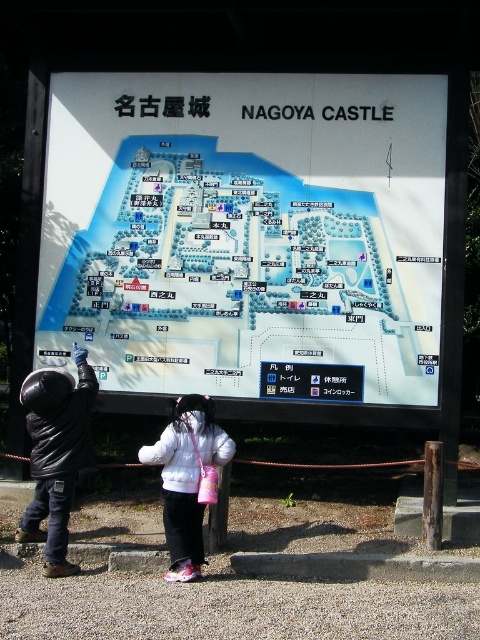
You are a tourist at Nagoya Castle and see the map board. There is a point marked at coordinates (244, 228) on the white paper map at center. What does this point indicate?

The point at coordinates (244, 228) on the white paper map at center corresponds to a specific location or feature on the map, such as a restroom, shop, or historical site within the castle grounds.

You are a tour guide leading a group to the main entrance of Nagoya Castle. You notice two people in front of you. One is holding the white paper map at center, and the other is wearing the black matte jacket at lower left. If you want to approach the person who is closer to the map, which one should you approach?

The black matte jacket at lower left is only 5.98 feet away from the white paper map at center, so you should approach the person wearing the black matte jacket at lower left since they are closer to the map.